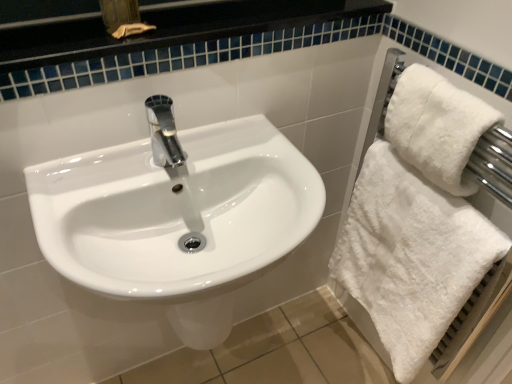
Question: Would you consider white fluffy towel at right to be distant from white fluffy towel at right?

Choices:
 (A) yes
 (B) no

Answer: (B)

Question: From a real-world perspective, is white fluffy towel at right positioned over white fluffy towel at right based on gravity?

Choices:
 (A) no
 (B) yes

Answer: (B)

Question: Does white fluffy towel at right have a greater height compared to white fluffy towel at right?

Choices:
 (A) no
 (B) yes

Answer: (A)

Question: Considering the relative sizes of white fluffy towel at right and white fluffy towel at right in the image provided, is white fluffy towel at right bigger than white fluffy towel at right?

Choices:
 (A) no
 (B) yes

Answer: (A)

Question: Could white fluffy towel at right be considered to be inside white fluffy towel at right?

Choices:
 (A) no
 (B) yes

Answer: (A)

Question: Is white fluffy towel at right located outside white fluffy towel at right?

Choices:
 (A) no
 (B) yes

Answer: (B)

Question: Considering the relative positions of white glossy sink at center and white fluffy towel at right in the image provided, is white glossy sink at center to the right of white fluffy towel at right from the viewer's perspective?

Choices:
 (A) yes
 (B) no

Answer: (B)

Question: Is white glossy sink at center wider than white fluffy towel at right?

Choices:
 (A) yes
 (B) no

Answer: (A)

Question: From a real-world perspective, is white glossy sink at center positioned under white fluffy towel at right based on gravity?

Choices:
 (A) yes
 (B) no

Answer: (A)

Question: Does white glossy sink at center have a greater height compared to white fluffy towel at right?

Choices:
 (A) no
 (B) yes

Answer: (B)

Question: Considering the relative positions of white glossy sink at center and white fluffy towel at right in the image provided, is white glossy sink at center in front of white fluffy towel at right?

Choices:
 (A) no
 (B) yes

Answer: (B)

Question: Does white glossy sink at center have a smaller size compared to white fluffy towel at right?

Choices:
 (A) no
 (B) yes

Answer: (A)

Question: Does white fluffy towel at right touch white glossy sink at center?

Choices:
 (A) no
 (B) yes

Answer: (A)